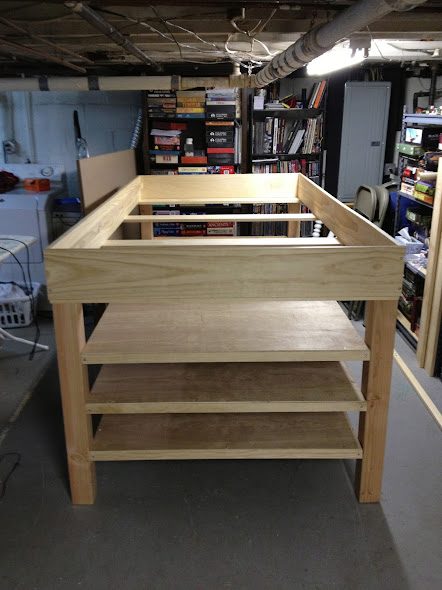
Where is `shelf`? shelf is located at coordinates (195, 131).